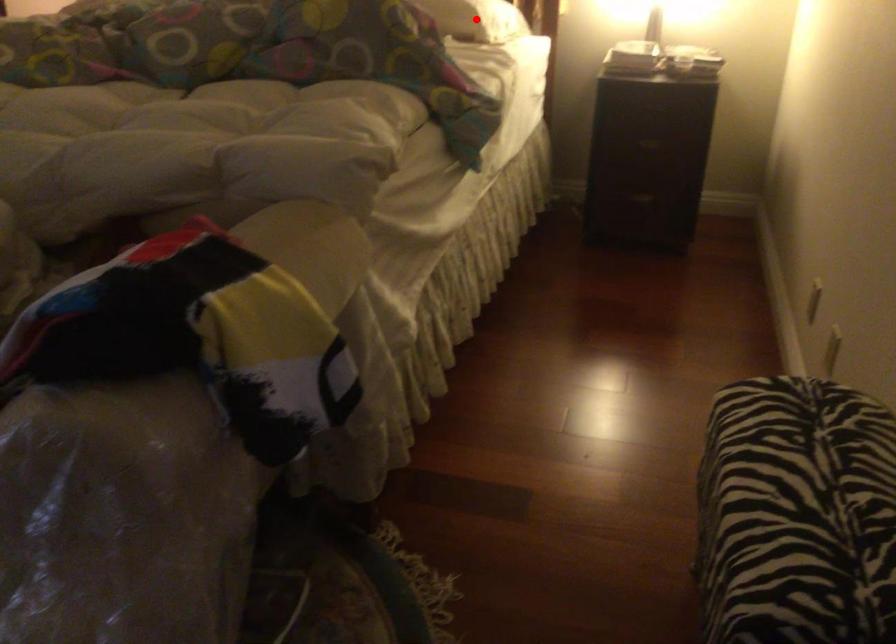
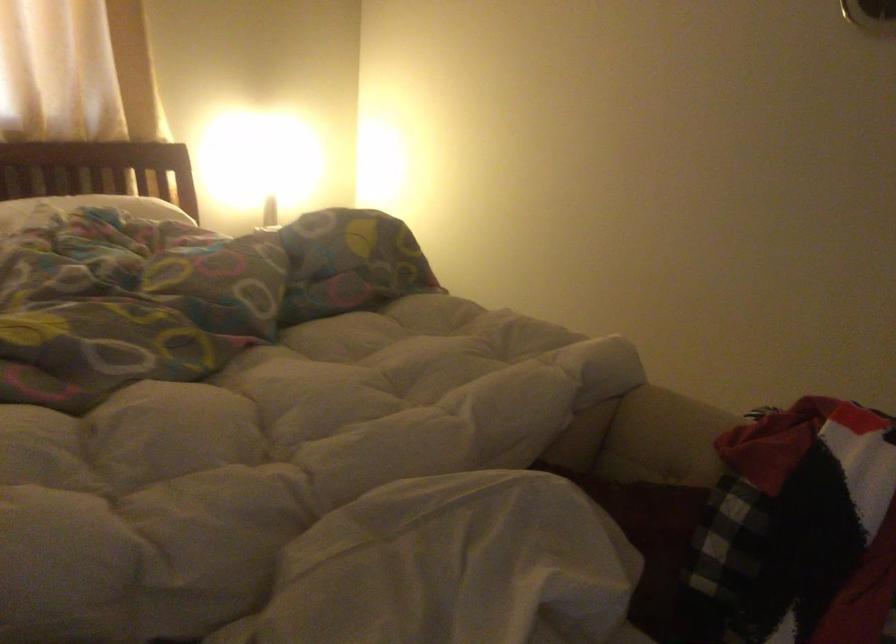
Question: I am providing you with two images of the same scene from different viewpoints. A red point is marked on the first image. At the location where the point appears in image 1, is it still visible in image 2?

Choices:
 (A) Yes
 (B) No

Answer: (B)